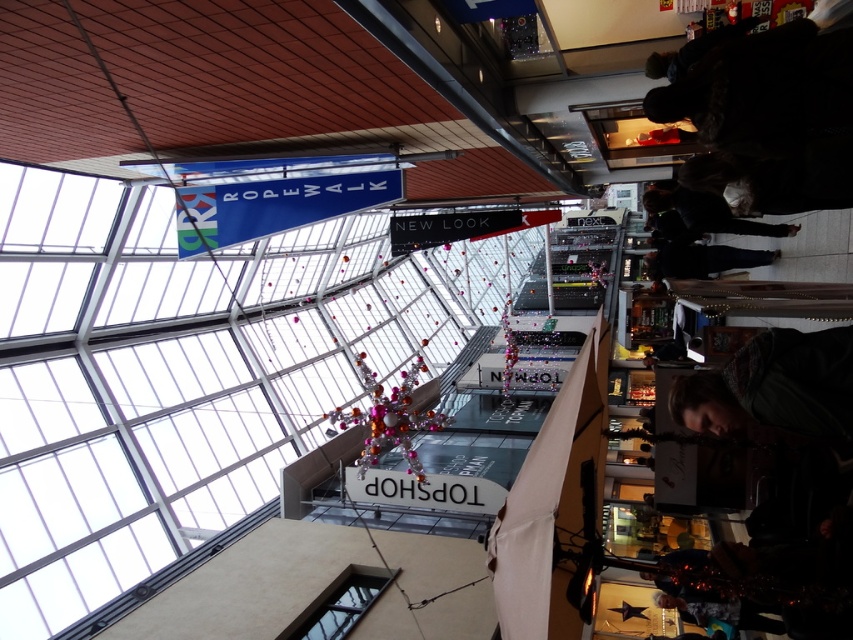
In the scene shown: You are a store employee organizing a display in the mall. You have a dark green sweater at lower right and a dark brown leather jacket at center. Which item should you place on the smaller hanger to ensure it fits properly?

The dark green sweater at lower right is smaller than the dark brown leather jacket at center, so it should be placed on the smaller hanger to fit properly.

You are a customer in the mall looking for a jacket and a sweater. You see the dark green sweater at lower right and the dark brown leather jacket at center. Which clothing item is positioned lower in the store?

The dark green sweater at lower right is positioned below the dark brown leather jacket at center, so it is lower in the store.